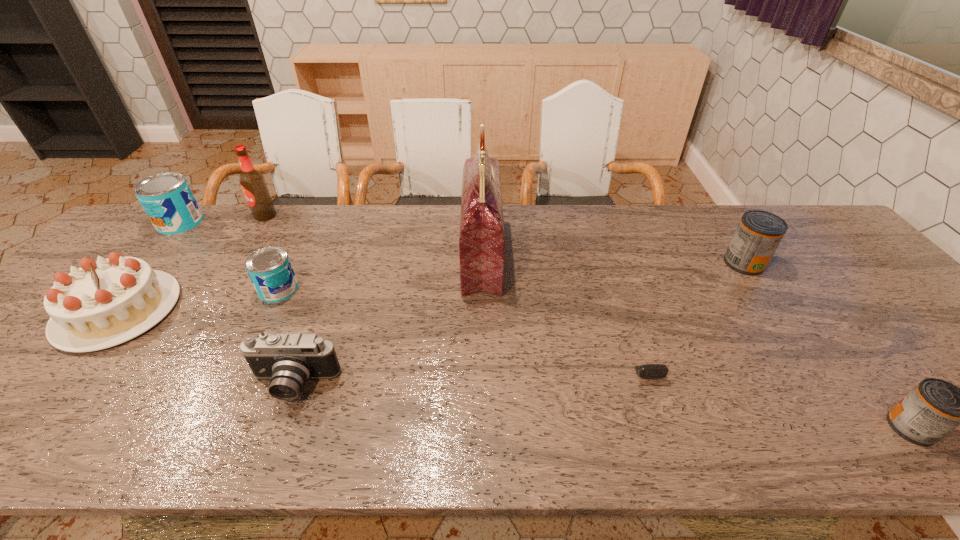
You are a GUI agent. You are given a task and a screenshot of the screen. Output one action in this format:
    pyautogui.click(x=<x>, y=<y>)
    Task: Click on the smaller blue can
    The image size is (960, 540).
    Given the screenshot: What is the action you would take?
    pyautogui.click(x=270, y=270)

Find the location of a particular element. The width and height of the screenshot is (960, 540). the right blue can is located at coordinates (270, 270).

Find the location of a particular element. This screenshot has height=540, width=960. the smaller red can is located at coordinates (934, 408).

I want to click on the nearest can, so click(934, 408).

Image resolution: width=960 pixels, height=540 pixels. Identify the location of webcam. (648, 370).

The image size is (960, 540). What are the coordinates of `the seventh object from left to right` in the screenshot? It's located at (648, 370).

Where is `free space located on the front-facing side of the tallest object`? The image size is (960, 540). free space located on the front-facing side of the tallest object is located at coordinates (395, 256).

The height and width of the screenshot is (540, 960). Identify the location of vacant space located on the front-facing side of the tallest object. (364, 256).

Find the location of `free spot located 0.210m on the front-facing side of the tallest object`. free spot located 0.210m on the front-facing side of the tallest object is located at coordinates (391, 256).

The height and width of the screenshot is (540, 960). Identify the location of blank space located 0.160m on the right of the beer bottle. (324, 216).